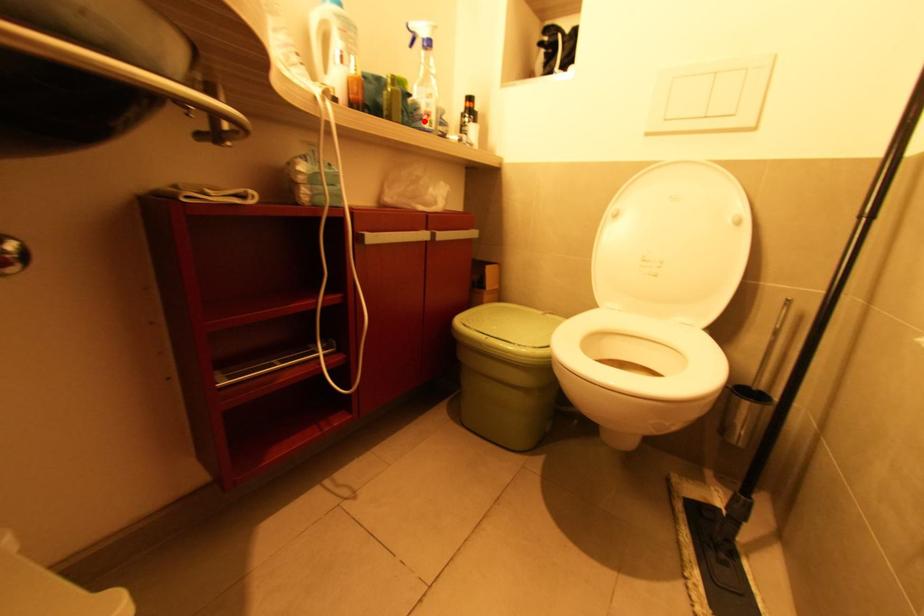
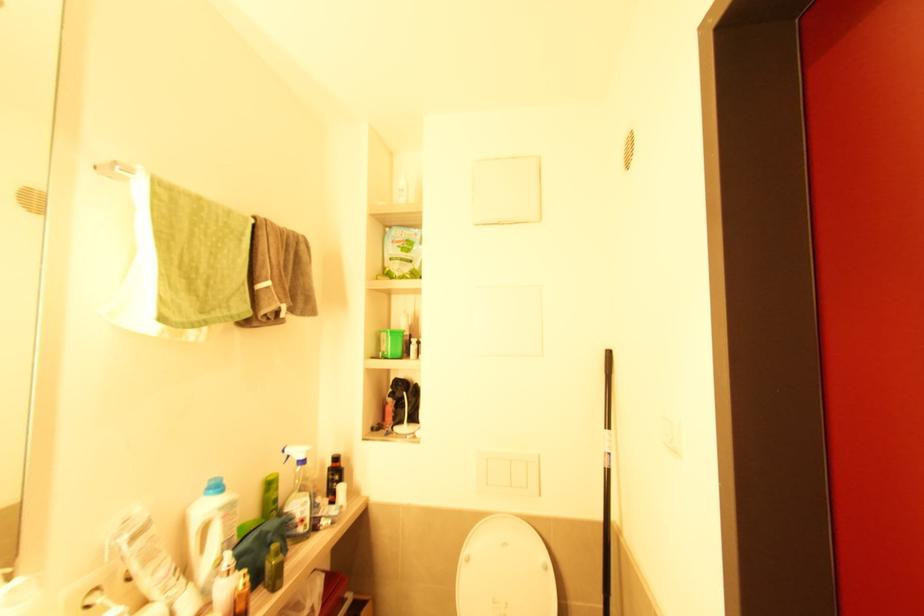
Locate, in the second image, the point that corresponds to the highlighted location in the first image.

(298, 527)